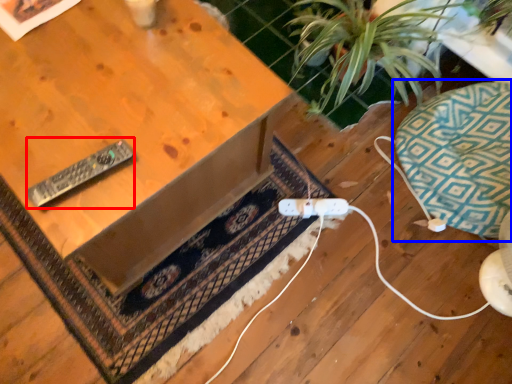
Question: Which object is further to the camera taking this photo, remote (highlighted by a red box) or swivel chair (highlighted by a blue box)?

Choices:
 (A) remote
 (B) swivel chair

Answer: (B)